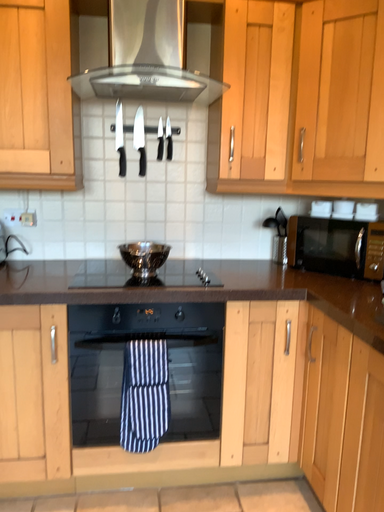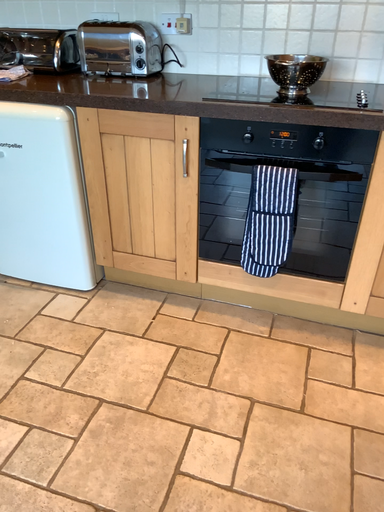
Question: How did the camera likely rotate when shooting the video?

Choices:
 (A) rotated left
 (B) rotated right

Answer: (A)